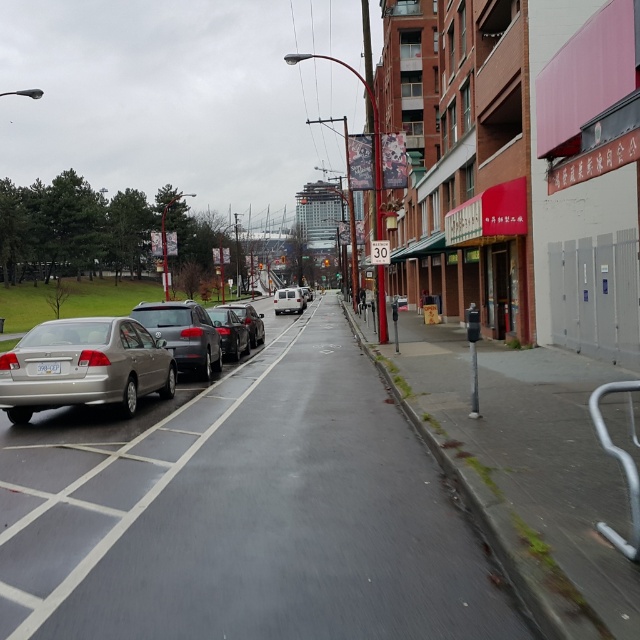
Question: Among these objects, which one is nearest to the camera?

Choices:
 (A) white matte van at center
 (B) shiny black sedan at center-left
 (C) shiny black sedan at center

Answer: (C)

Question: Does satin silver sedan at left have a greater width compared to shiny black sedan at center?

Choices:
 (A) yes
 (B) no

Answer: (A)

Question: Which point appears closest to the camera in this image?

Choices:
 (A) (132, 312)
 (B) (240, 344)

Answer: (A)

Question: Where is shiny black sedan at center-left located in relation to white plastic license plate at center in the image?

Choices:
 (A) left
 (B) right

Answer: (A)

Question: Estimate the real-world distances between objects in this image. Which object is closer to the white plastic license plate at center?

Choices:
 (A) silver metallic sedan at left
 (B) satin silver sedan at left
 (C) shiny black sedan at center-left

Answer: (A)

Question: Can you confirm if silver metallic sedan at left is positioned to the left of shiny black sedan at center-left?

Choices:
 (A) no
 (B) yes

Answer: (A)